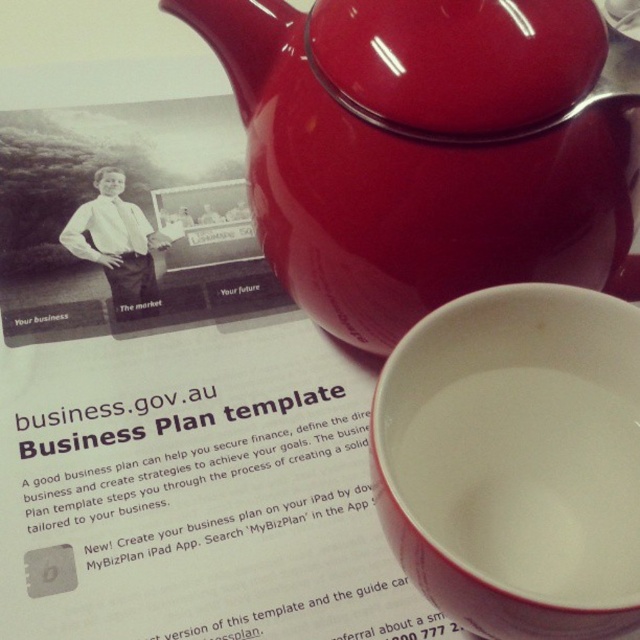
Question: Among these objects, which one is nearest to the camera?

Choices:
 (A) glossy ceramic teapot at upper center
 (B) white glossy teacup at lower right

Answer: (B)

Question: Can you confirm if glossy ceramic teapot at upper center is thinner than white glossy teacup at lower right?

Choices:
 (A) no
 (B) yes

Answer: (A)

Question: Is the position of glossy ceramic teapot at upper center more distant than that of white glossy teacup at lower right?

Choices:
 (A) no
 (B) yes

Answer: (B)

Question: Can you confirm if glossy ceramic teapot at upper center is smaller than white glossy teacup at lower right?

Choices:
 (A) yes
 (B) no

Answer: (B)

Question: Which of the following is the closest to the observer?

Choices:
 (A) white glossy teacup at lower right
 (B) glossy ceramic teapot at upper center

Answer: (A)